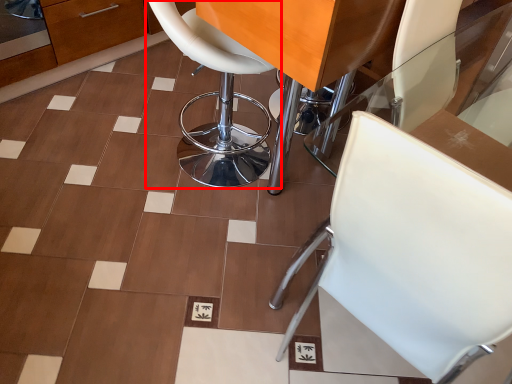
Question: From the image's perspective, considering the relative positions of chair (annotated by the red box) and chair in the image provided, where is chair (annotated by the red box) located with respect to the staircase?

Choices:
 (A) above
 (B) below

Answer: (A)